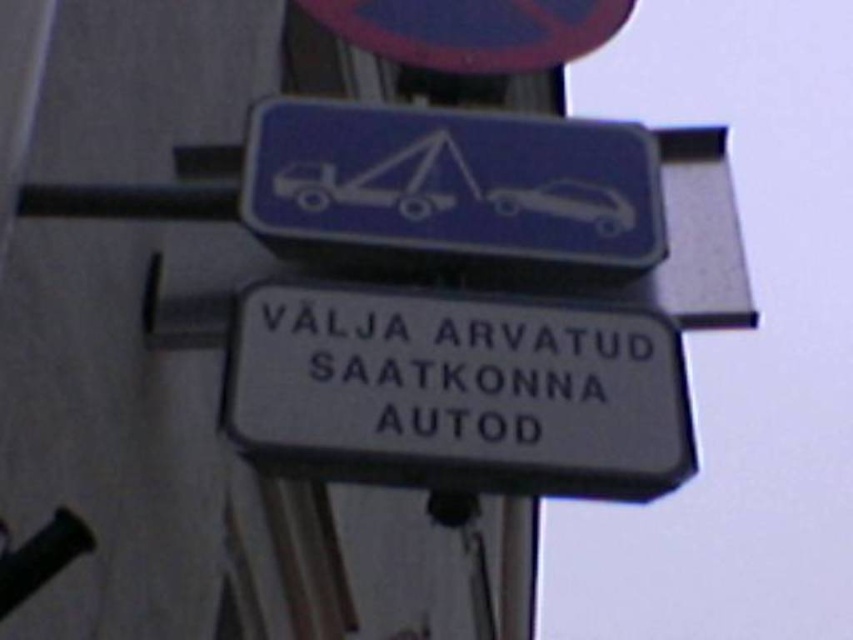
Who is positioned more to the left, blue plastic sign at upper center or white glossy car at upper center?

blue plastic sign at upper center is more to the left.

Which of these two, blue plastic sign at upper center or white glossy car at upper center, stands shorter?

white glossy car at upper center

Is point (492, 17) closer to camera compared to point (566, 186)?

No, (492, 17) is further to viewer.

You are a GUI agent. You are given a task and a screenshot of the screen. Output one action in this format:
    pyautogui.click(x=<x>, y=<y>)
    Task: Click on the blue plastic sign at upper center
    Image resolution: width=853 pixels, height=640 pixels.
    Given the screenshot: What is the action you would take?
    pyautogui.click(x=474, y=29)

Is white plastic sign at center below blue plastic sign at upper center?

Yes.

Is white plastic sign at center shorter than blue plastic sign at upper center?

In fact, white plastic sign at center may be taller than blue plastic sign at upper center.

Which is behind, point (627, 388) or point (404, 49)?

The point (404, 49) is more distant.

Find the location of a particular element. The image size is (853, 640). white plastic sign at center is located at coordinates (459, 392).

Can you confirm if blue glossy tow truck at upper center is bigger than blue plastic sign at upper center?

Yes.

Does blue glossy tow truck at upper center lie in front of blue plastic sign at upper center?

That is True.

Is point (550, 250) farther from viewer compared to point (457, 33)?

No, (550, 250) is closer to viewer.

Where is `blue glossy tow truck at upper center`? The image size is (853, 640). blue glossy tow truck at upper center is located at coordinates (451, 186).